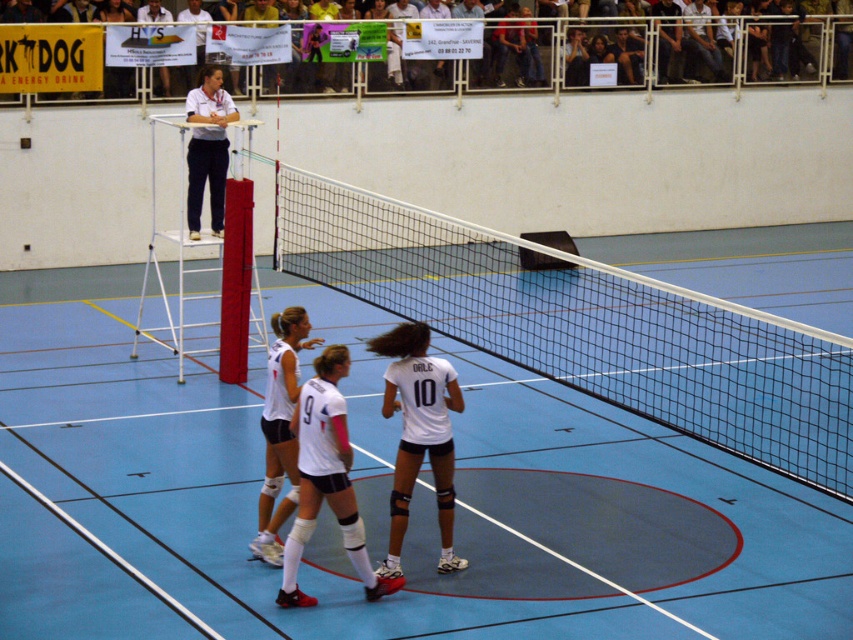
Which is above, blue rubber volleyball court at center or white matte shorts at center?

blue rubber volleyball court at center is above.

Does blue rubber volleyball court at center have a smaller size compared to white matte shorts at center?

No.

In order to click on blue rubber volleyball court at center in this screenshot , I will do `click(416, 486)`.

What are the coordinates of `blue rubber volleyball court at center` in the screenshot? It's located at pos(416,486).

Does white matte shorts at center appear under white matte uniform at center?

Yes, white matte shorts at center is below white matte uniform at center.

Does white matte shorts at center have a greater height compared to white matte uniform at center?

No, white matte shorts at center is not taller than white matte uniform at center.

The height and width of the screenshot is (640, 853). Describe the element at coordinates (326, 477) in the screenshot. I see `white matte shorts at center` at that location.

Locate an element on the screen. This screenshot has height=640, width=853. white matte shorts at center is located at coordinates (326, 477).

Is white matte/vinyl jersey at center smaller than white matte uniform at center?

Incorrect, white matte/vinyl jersey at center is not smaller in size than white matte uniform at center.

Does point (401, 388) come behind point (294, 484)?

No, (401, 388) is closer to viewer.

In order to click on white matte/vinyl jersey at center in this screenshot , I will do `click(419, 435)`.